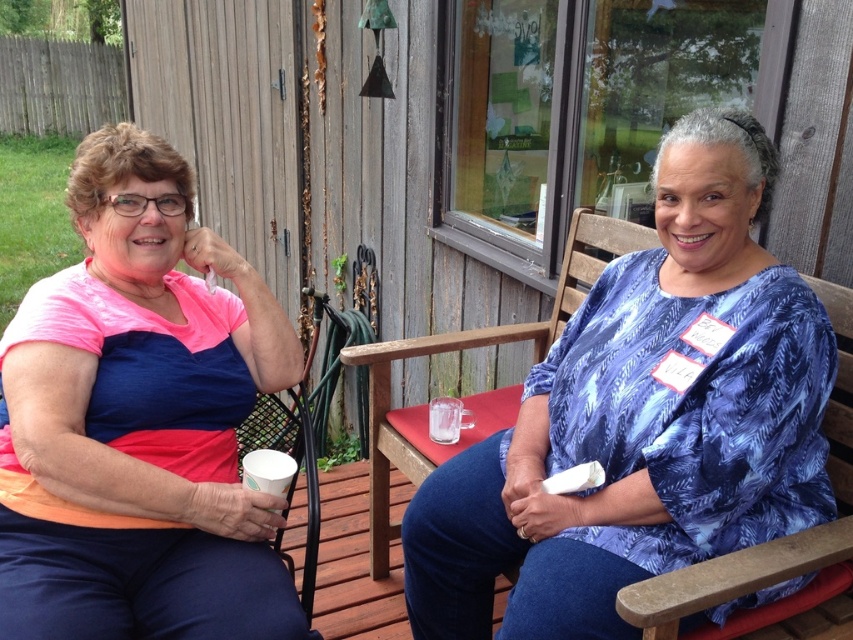
Question: Which point is closer to the camera taking this photo?

Choices:
 (A) (x=838, y=628)
 (B) (x=265, y=332)
 (C) (x=469, y=630)
 (D) (x=480, y=429)

Answer: (A)

Question: Is pink fabric shirt at left further to the viewer compared to wooden chair at center?

Choices:
 (A) no
 (B) yes

Answer: (A)

Question: Among these points, which one is nearest to the camera?

Choices:
 (A) (422, 474)
 (B) (119, 138)
 (C) (258, 467)
 (D) (430, 432)

Answer: (C)

Question: Does blue printed blouse at center come behind wooden chair at right?

Choices:
 (A) no
 (B) yes

Answer: (B)

Question: Is blue printed blouse at center below transparent glass cup at center?

Choices:
 (A) yes
 (B) no

Answer: (A)

Question: Based on their relative distances, which object is farther from the wooden chair at right?

Choices:
 (A) wooden chair at center
 (B) blue printed blouse at center
 (C) pink fabric shirt at left
 (D) transparent glass cup at center

Answer: (C)